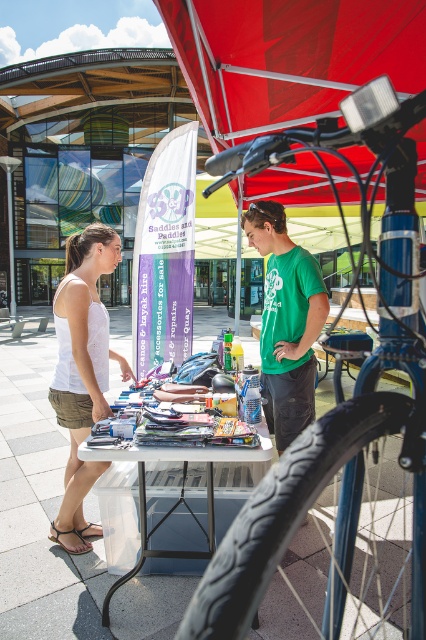
You are standing at the center of the market and see the blue metallic bicycle at center. What is located at the point with coordinates (344, 452)?

The blue metallic bicycle at center is located at point (344, 452).